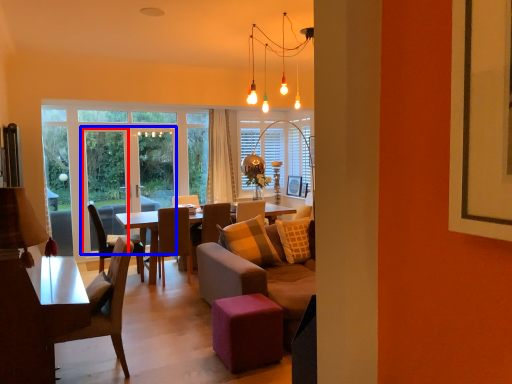
Question: Which object is closer to the camera taking this photo, screen door (highlighted by a red box) or screen door (highlighted by a blue box)?

Choices:
 (A) screen door
 (B) screen door

Answer: (B)